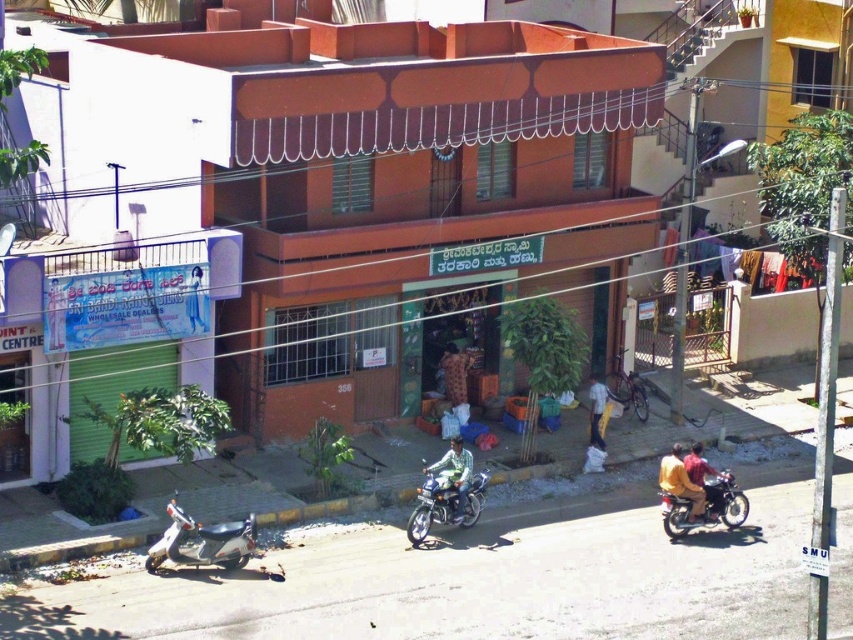
You are a customer looking for a yellow fabric shirt at center to buy. You see a yellow fabric jacket at lower right nearby. Which item is closer to the entrance of the building?

The yellow fabric jacket at lower right is closer to the entrance of the building because it is positioned to the left of the yellow fabric shirt at center, which places it nearer to the entrance area.

Looking at this image, you are a delivery person with a package that is 1.2 meters wide. You need to pass through the space between the silver metallic scooter at lower left and the yellow fabric jacket at lower right. Can your package fit through the space between them?

The silver metallic scooter at lower left might be wider than yellow fabric jacket at lower right, so the space between them may not be wide enough for a package that is 1.2 meters wide. It is uncertain and you should check the actual width before proceeding.